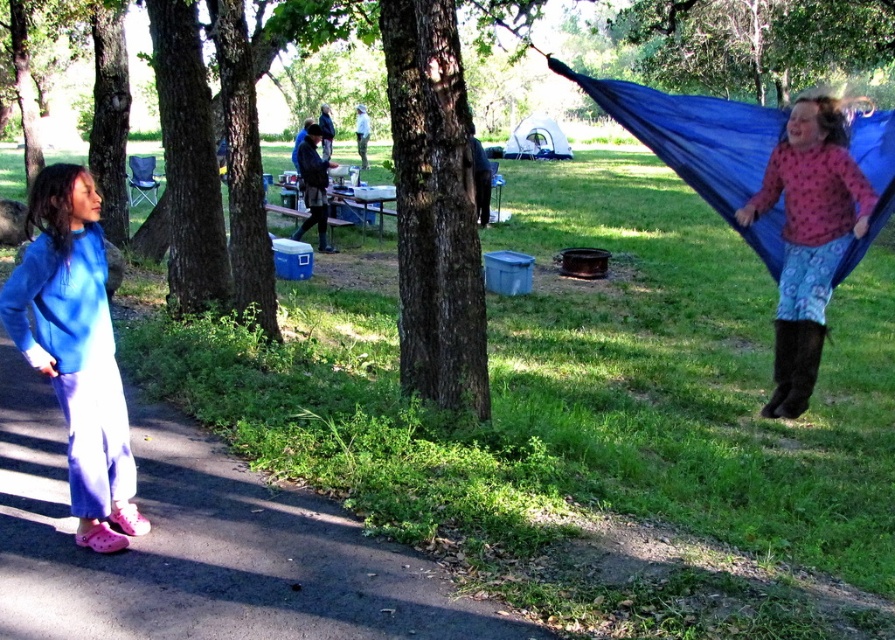
You are a parent at the campsite and want to ensure your child stays warm. You have a blue fleece sweatshirt at left and a blue fabric hammock at right. Which item is closer to the ground?

The blue fleece sweatshirt at left is located below the blue fabric hammock at right, so it is closer to the ground.